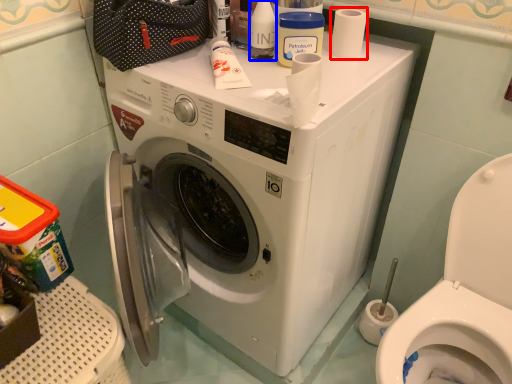
Question: Which object is further to the camera taking this photo, toilet paper (highlighted by a red box) or toiletry (highlighted by a blue box)?

Choices:
 (A) toilet paper
 (B) toiletry

Answer: (A)